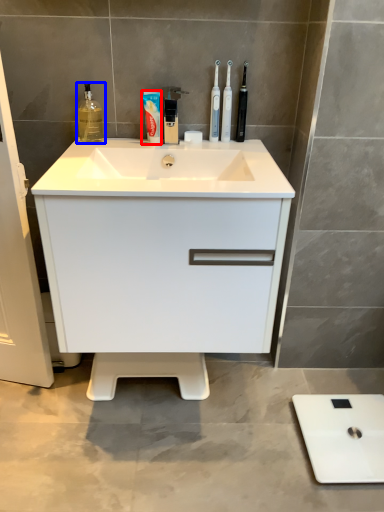
Question: Which object appears closest to the camera in this image, toothpaste (highlighted by a red box) or cleaning product (highlighted by a blue box)?

Choices:
 (A) toothpaste
 (B) cleaning product

Answer: (B)